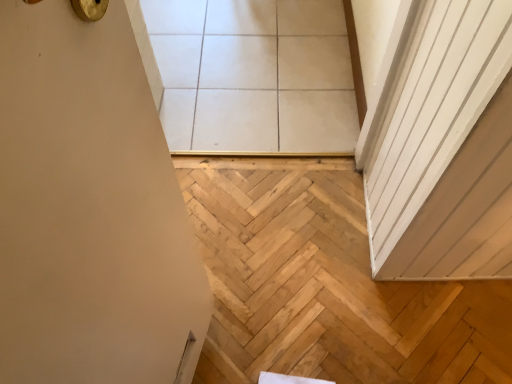
Question: Does point (415, 339) appear closer or farther from the camera than point (177, 102)?

Choices:
 (A) closer
 (B) farther

Answer: (A)

Question: Is natural wood stairwell at lower right spatially inside white glossy tile at upper center, or outside of it?

Choices:
 (A) outside
 (B) inside

Answer: (A)

Question: In the image, is natural wood stairwell at lower right positioned in front of or behind white glossy tile at upper center?

Choices:
 (A) behind
 (B) front

Answer: (B)

Question: From their relative heights in the image, would you say white glossy tile at upper center is taller or shorter than natural wood stairwell at lower right?

Choices:
 (A) short
 (B) tall

Answer: (A)

Question: From a real-world perspective, is white glossy tile at upper center physically located above or below natural wood stairwell at lower right?

Choices:
 (A) above
 (B) below

Answer: (A)

Question: In the image, is white glossy tile at upper center positioned in front of or behind natural wood stairwell at lower right?

Choices:
 (A) front
 (B) behind

Answer: (B)

Question: Is white glossy tile at upper center situated inside natural wood stairwell at lower right or outside?

Choices:
 (A) inside
 (B) outside

Answer: (B)